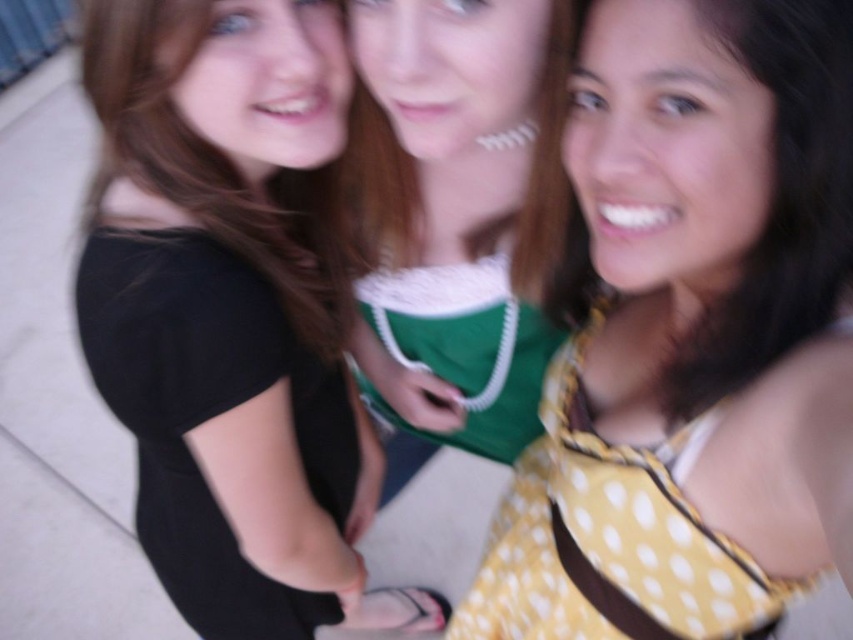
You are a GUI agent. You are given a task and a screenshot of the screen. Output one action in this format:
    pyautogui.click(x=<x>, y=<y>)
    Task: Click on the black matte shirt at upper left
    The height and width of the screenshot is (640, 853).
    Given the screenshot: What is the action you would take?
    (231, 312)

Can you confirm if black matte shirt at upper left is taller than yellow dotted dress at right?

Indeed, black matte shirt at upper left has a greater height compared to yellow dotted dress at right.

Between black matte shirt at upper left and yellow dotted dress at right, which one appears on the left side from the viewer's perspective?

From the viewer's perspective, black matte shirt at upper left appears more on the left side.

Describe the element at coordinates (231, 312) in the screenshot. I see `black matte shirt at upper left` at that location.

You are a GUI agent. You are given a task and a screenshot of the screen. Output one action in this format:
    pyautogui.click(x=<x>, y=<y>)
    Task: Click on the black matte shirt at upper left
    This screenshot has width=853, height=640.
    Given the screenshot: What is the action you would take?
    pyautogui.click(x=231, y=312)

Which is above, yellow dotted dress at center or yellow dotted dress at right?

Positioned higher is yellow dotted dress at right.

Who is positioned more to the left, yellow dotted dress at center or yellow dotted dress at right?

yellow dotted dress at right

The height and width of the screenshot is (640, 853). Identify the location of yellow dotted dress at center. (693, 333).